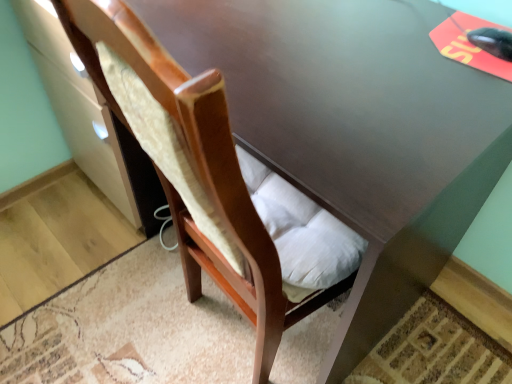
Where is `wooden chair at center`? wooden chair at center is located at coordinates (198, 170).

This screenshot has height=384, width=512. Describe the element at coordinates (198, 170) in the screenshot. I see `wooden chair at center` at that location.

Locate an element on the screen. The width and height of the screenshot is (512, 384). wooden chair at center is located at coordinates [x=198, y=170].